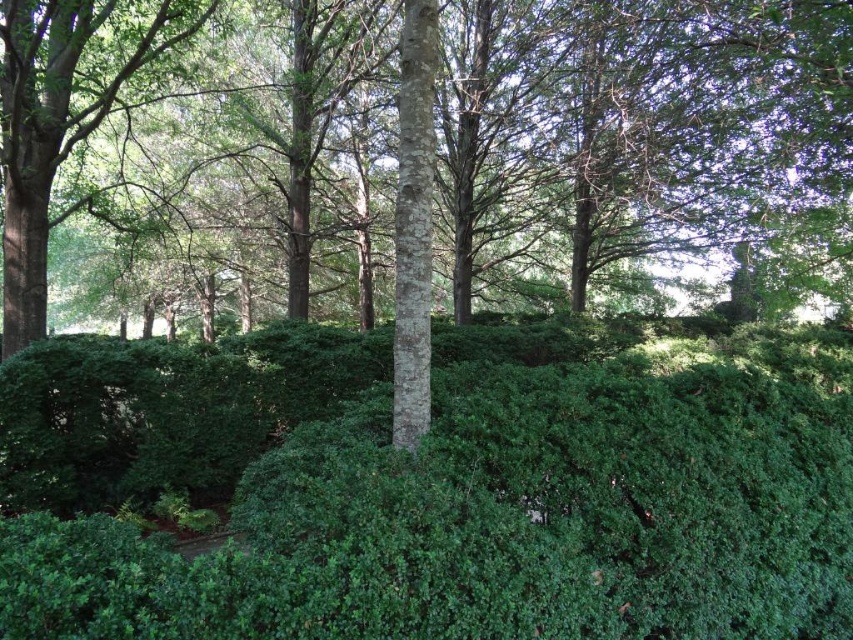
You are a gardener trying to determine which plant requires more sunlight. You see the green leafy hedge at center and the smooth bark tree at center. Which one is positioned closer to the sunlight?

The smooth bark tree at center is positioned closer to the sunlight because it is taller than the green leafy hedge at center, allowing it to reach more sunlight.

Based on the photo, you are a gardener planning to trim the green leafy hedge at center and the green leafy tree at left. Which one requires a ladder to reach the top?

The green leafy tree at left requires a ladder to reach the top since it is taller than the green leafy hedge at center.

You are standing in the landscape and want to walk towards the smooth bark tree at center and the green leafy tree at left. Which tree will you reach first?

You will reach the smooth bark tree at center first because it is closer to the viewer than the green leafy tree at left.